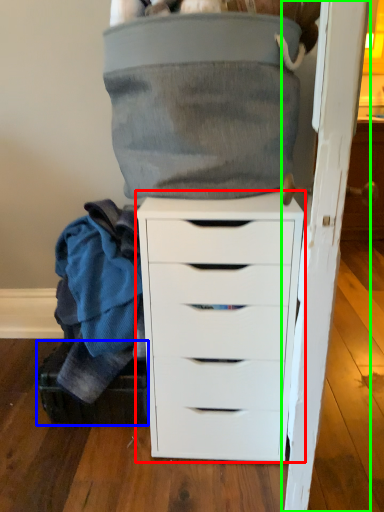
Question: Based on their relative distances, which object is farther from chest of drawers (highlighted by a red box)? Choose from shoe box (highlighted by a blue box) and door (highlighted by a green box).

Choices:
 (A) shoe box
 (B) door

Answer: (A)